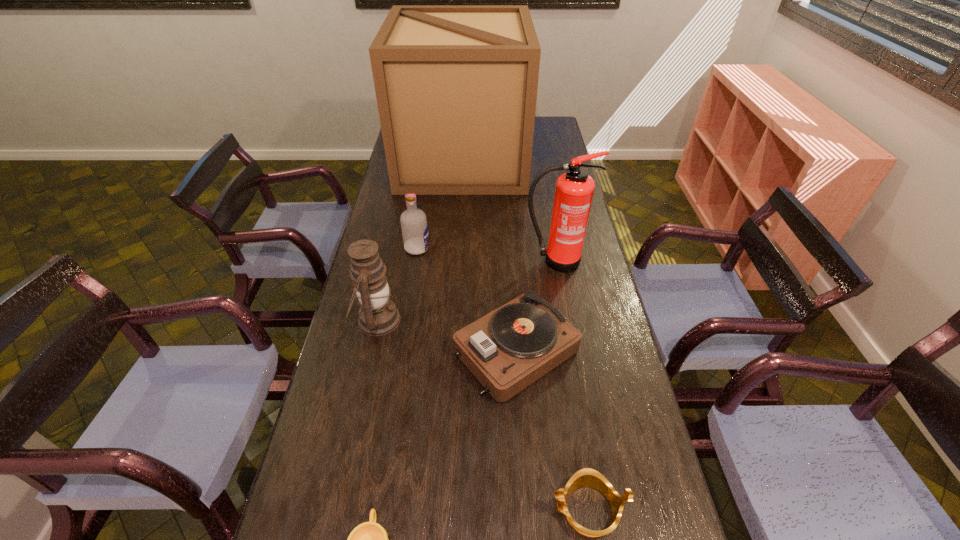
At what (x,y) coordinates should I click in order to perform the action: click on free region at the far right corner of the desktop. Please return your answer as a coordinate pair (x, y). The height and width of the screenshot is (540, 960). Looking at the image, I should click on (556, 130).

Identify the location of free point between the fire extinguisher and the fifth shortest object. (466, 291).

Where is `empty space between the oil lamp and the second tallest object`? empty space between the oil lamp and the second tallest object is located at coordinates (466, 291).

Locate an element on the screen. The height and width of the screenshot is (540, 960). free point between the oil lamp and the sixth shortest object is located at coordinates (466, 291).

At what (x,y) coordinates should I click in order to perform the action: click on object that stands as the fourth closest to the fire extinguisher. Please return your answer as a coordinate pair (x, y). Image resolution: width=960 pixels, height=540 pixels. Looking at the image, I should click on (378, 315).

Where is `object identified as the closest to the fourth shortest object`? This screenshot has height=540, width=960. object identified as the closest to the fourth shortest object is located at coordinates (378, 315).

Where is `vacant region that satisfies the following two spatial constraints: 1. on the label of the fourth tallest object; 2. on the right side of the record player`? This screenshot has width=960, height=540. vacant region that satisfies the following two spatial constraints: 1. on the label of the fourth tallest object; 2. on the right side of the record player is located at coordinates (x=401, y=351).

Where is `vacant region that satisfies the following two spatial constraints: 1. on the reinforced sides of the record player; 2. on the left side of the tallest object`? vacant region that satisfies the following two spatial constraints: 1. on the reinforced sides of the record player; 2. on the left side of the tallest object is located at coordinates (451, 351).